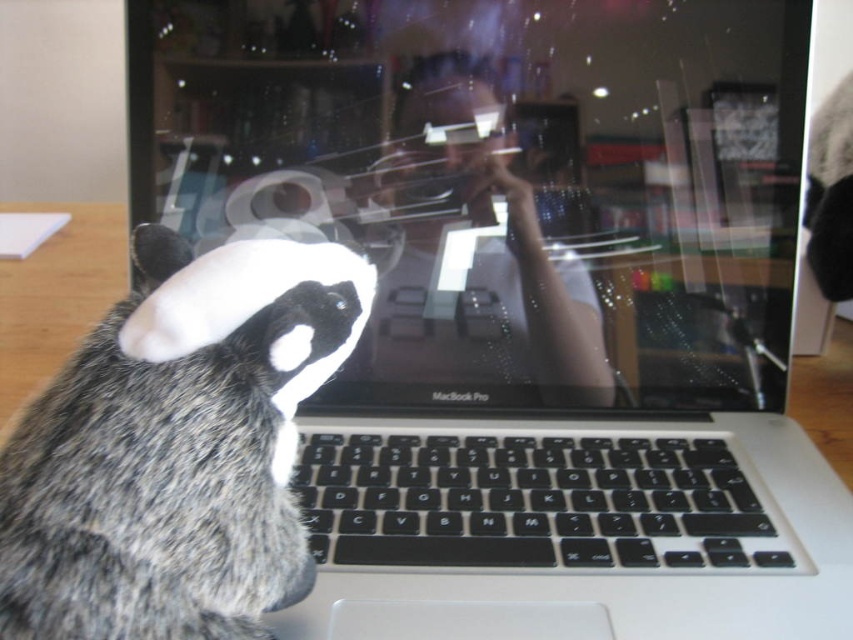
Is point (244, 552) positioned in front of point (457, 506)?

That is True.

Which is in front, point (160, 515) or point (480, 525)?

Point (160, 515) is more forward.

Locate an element on the screen. The height and width of the screenshot is (640, 853). fuzzy fur cat at left is located at coordinates (177, 448).